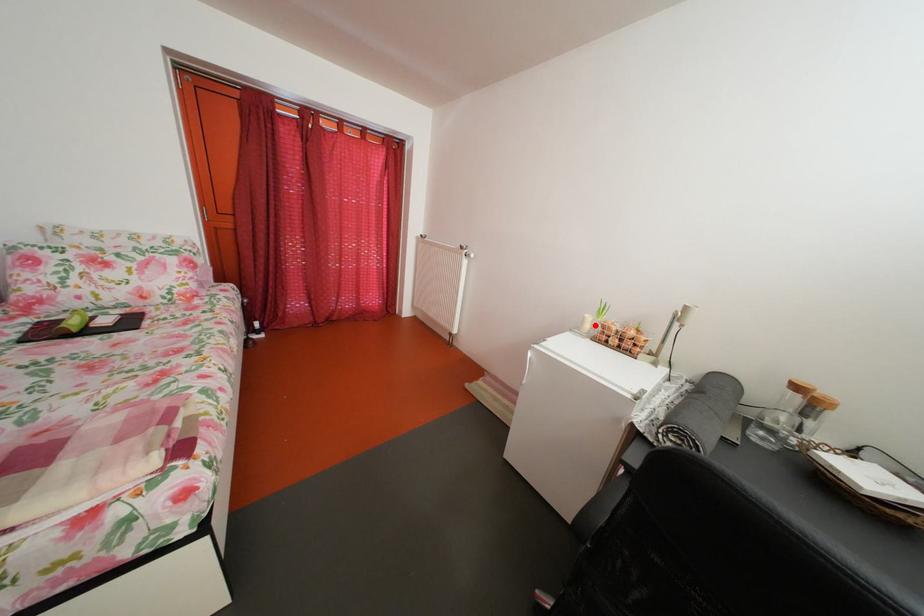
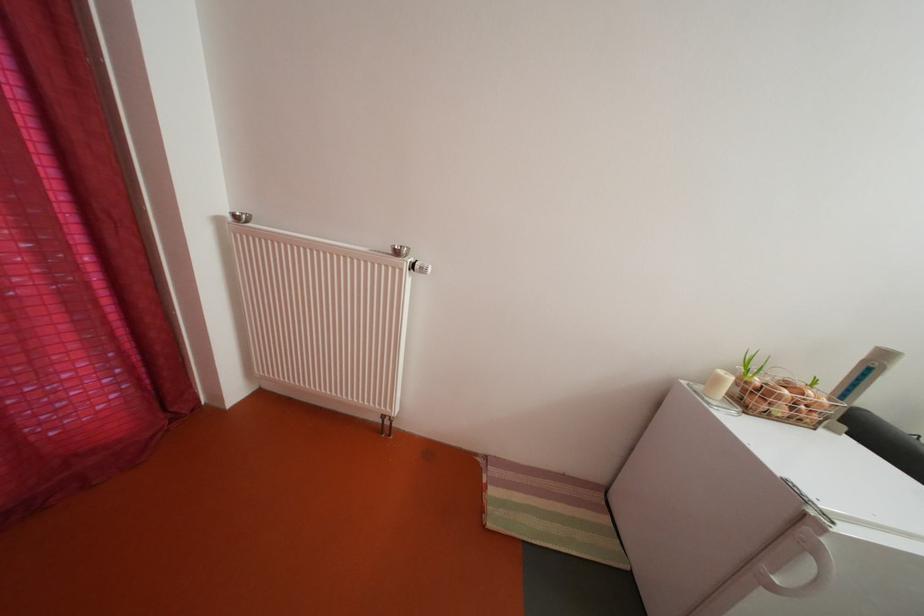
Question: I am providing you with two images of the same scene from different viewpoints. A red point is marked on the first image. Can you still see the location of the red point in image 2?

Choices:
 (A) Yes
 (B) No

Answer: (A)